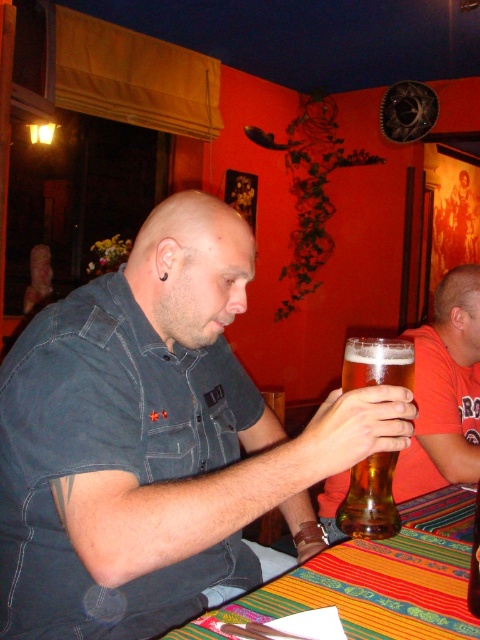
Question: Is the position of multicolored woven mat at lower center more distant than that of translucent glass beer at center?

Choices:
 (A) yes
 (B) no

Answer: (B)

Question: From the image, what is the correct spatial relationship of translucent glass beer at center in relation to golden glass beer at center?

Choices:
 (A) right
 (B) left

Answer: (A)

Question: Which of the following is the farthest from the observer?

Choices:
 (A) click(x=348, y=339)
 (B) click(x=470, y=272)
 (C) click(x=205, y=212)

Answer: (B)

Question: From the image, what is the correct spatial relationship of denim shirt at center in relation to golden glass beer at center?

Choices:
 (A) above
 (B) below

Answer: (A)

Question: Which object appears closest to the camera in this image?

Choices:
 (A) multicolored woven mat at lower center
 (B) translucent glass beer at center
 (C) golden glass beer at center
 (D) denim shirt at center

Answer: (A)

Question: Estimate the real-world distances between objects in this image. Which object is farther from the golden glass beer at center?

Choices:
 (A) multicolored woven mat at lower center
 (B) translucent glass beer at center
 (C) denim shirt at center

Answer: (B)